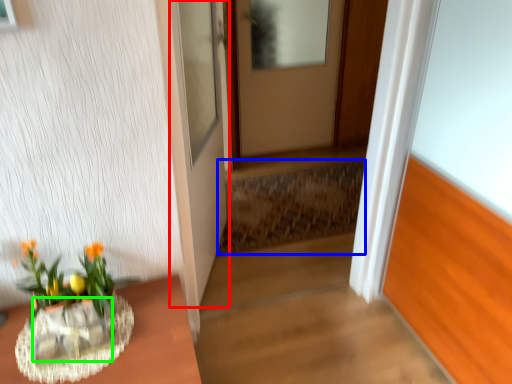
Question: Which is nearer to the door (highlighted by a red box)? stairwell (highlighted by a blue box) or glass vase (highlighted by a green box).

Choices:
 (A) stairwell
 (B) glass vase

Answer: (A)